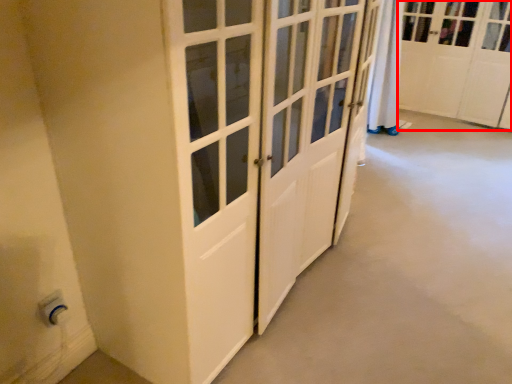
Question: Observing the image, what is the correct spatial positioning of cabinetry (annotated by the red box) in reference to electric outlet?

Choices:
 (A) left
 (B) right

Answer: (B)